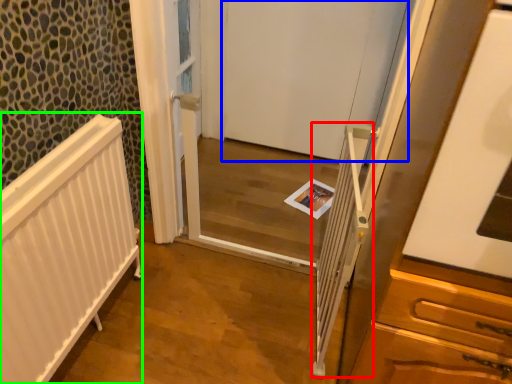
Question: Considering the real-world distances, which object is closest to balustrade (highlighted by a red box)? door (highlighted by a blue box) or radiator (highlighted by a green box).

Choices:
 (A) door
 (B) radiator

Answer: (B)